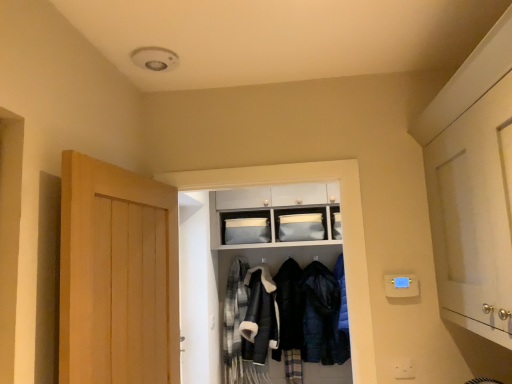
Question: From the image's perspective, relative to matte gray fabric storage at upper center, is light brown wooden door at left, the first door when ordered from left to right, above or below?

Choices:
 (A) above
 (B) below

Answer: (B)

Question: From a real-world perspective, is light brown wooden door at left, the first door when ordered from left to right, physically located above or below matte gray fabric storage at upper center?

Choices:
 (A) above
 (B) below

Answer: (B)

Question: Which of these objects is positioned farthest from the leather jacket at center, marked as the second clothing in a left-to-right arrangement?

Choices:
 (A) black fuzzy coat at center, the third clothing in the left-to-right sequence
 (B) white glossy cabinet at right, positioned as the first door in right-to-left order
 (C) dark blue quilted jacket at center, which is the fourth clothing in left-to-right order
 (D) matte gray fabric storage at upper center
 (E) fluffy wool scarf at center, acting as the first clothing starting from the left

Answer: (B)

Question: Which of these objects is positioned farthest from the white fabric coat at center?

Choices:
 (A) dark blue quilted jacket at center, which is the fourth clothing in left-to-right order
 (B) light brown wooden door at left, the first door when ordered from left to right
 (C) leather jacket at center, arranged as the 3th clothing when viewed from the right
 (D) black fuzzy coat at center, the third clothing in the left-to-right sequence
 (E) matte gray fabric storage at upper center

Answer: (B)